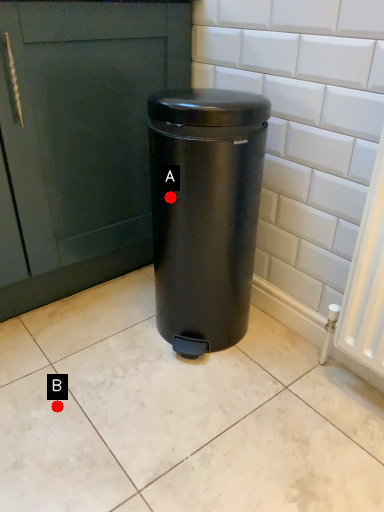
Question: Two points are circled on the image, labeled by A and B beside each circle. Which point is farther from the camera taking this photo?

Choices:
 (A) A is further
 (B) B is further

Answer: (B)